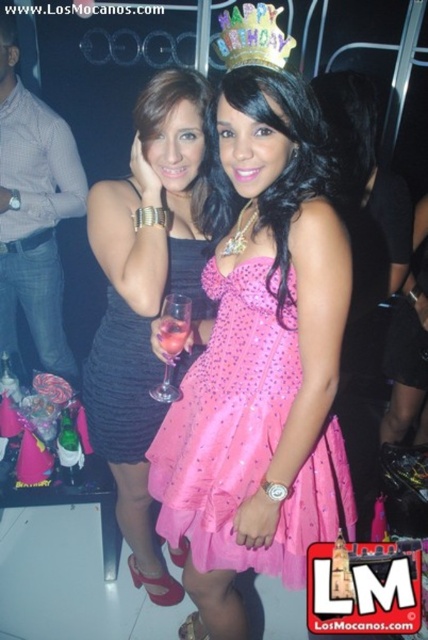
From the picture: You are a photographer at the party and need to capture a closeup of the black satin dress at center and the clear glass at center. Since the camera can only focus on one object at a time, which object should you focus on first to ensure it fills the frame properly?

The black satin dress at center is wider than the clear glass at center, so you should focus on the black satin dress at center first to ensure it fills the frame properly.

You are a photographer at the party and want to capture a closeup of the birthday girl in her pink satin dress at center without the clear glass at center blocking the shot. Can you position yourself so that the glass doesn not appear in the frame?

The pink satin dress at center might be wider than clear glass at center, so it is possible that the glass could be positioned to one side if the dress is wider, allowing the photographer to angle the camera to avoid the glass. However, without exact measurements, this is uncertain. The photographer should test different angles to ensure the glass is out of frame.

You are at a party and want to take a photo of both the matte black dress at center and the black satin dress at center. Since they are both at the center, how can you ensure both dresses are fully visible in the photo?

The matte black dress at center is in front of the black satin dress at center, so to ensure both are fully visible, you should adjust your angle to avoid the matte black dress blocking the black satin dress behind it.